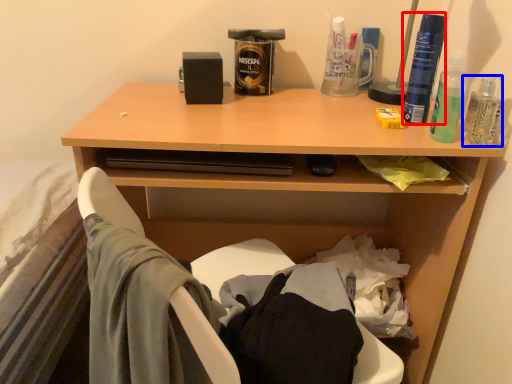
Question: Which object appears farthest to the camera in this image, bottle (highlighted by a red box) or bottle (highlighted by a blue box)?

Choices:
 (A) bottle
 (B) bottle

Answer: (A)